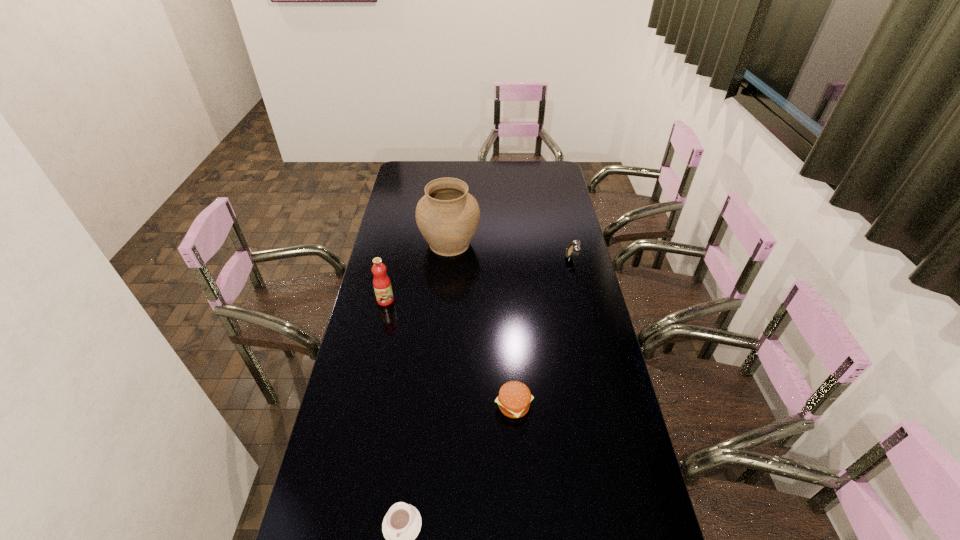
Find the location of a particular element. The image size is (960, 540). the tallest object is located at coordinates (447, 216).

Identify the location of fruit juice. (382, 286).

At what (x,y) coordinates should I click in order to perform the action: click on the third nearest object. Please return your answer as a coordinate pair (x, y). The height and width of the screenshot is (540, 960). Looking at the image, I should click on (382, 286).

Image resolution: width=960 pixels, height=540 pixels. I want to click on alarm clock, so click(572, 251).

The height and width of the screenshot is (540, 960). In order to click on the rightmost object in this screenshot , I will do `click(572, 251)`.

Identify the location of the second nearest object. This screenshot has width=960, height=540. (514, 398).

Identify the location of the second object from right to left. (514, 398).

Locate an element on the screen. The height and width of the screenshot is (540, 960). vacant space situated on the left of the urn is located at coordinates (387, 244).

Where is `vacant space located on the front label of the leftmost object`? vacant space located on the front label of the leftmost object is located at coordinates (377, 338).

Where is `vacant space located on the face of the rightmost object`? vacant space located on the face of the rightmost object is located at coordinates (480, 258).